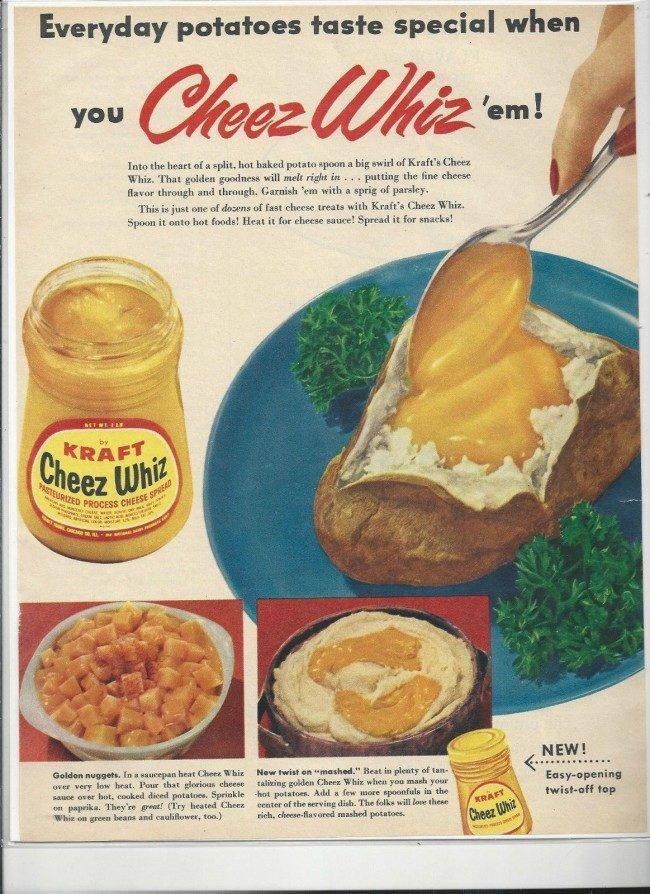
Find the location of a particular element. The image size is (650, 894). plate is located at coordinates (290, 434).